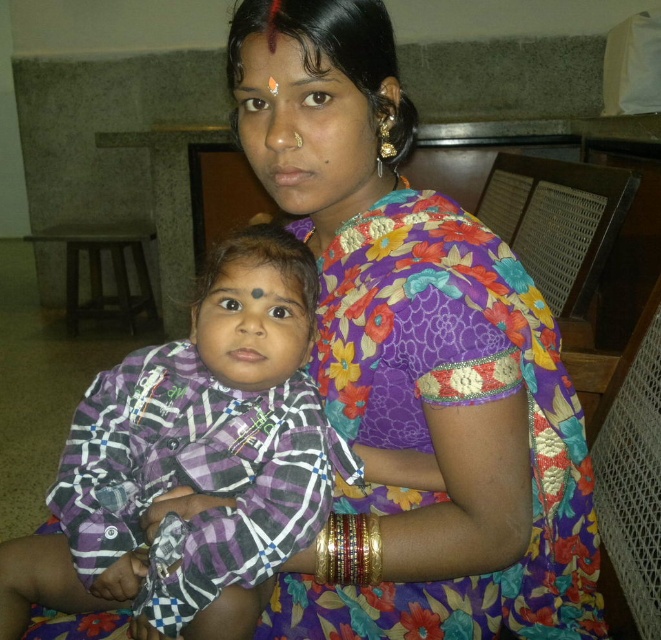
Question: Is floral silk saree at center behind matte black forehead at upper center?

Choices:
 (A) no
 (B) yes

Answer: (B)

Question: Does purple checkered shirt at center appear on the left side of matte black forehead at upper center?

Choices:
 (A) no
 (B) yes

Answer: (B)

Question: Which object is farther from the camera taking this photo?

Choices:
 (A) purple checkered shirt at center
 (B) matte black forehead at upper center

Answer: (A)

Question: Based on their relative distances, which object is nearer to the floral silk saree at center?

Choices:
 (A) matte black forehead at upper center
 (B) purple checkered shirt at center

Answer: (B)

Question: Which of these objects is positioned farthest from the floral silk saree at center?

Choices:
 (A) matte black forehead at upper center
 (B) purple checkered shirt at center

Answer: (A)

Question: Can you confirm if purple checkered shirt at center is wider than matte black forehead at upper center?

Choices:
 (A) yes
 (B) no

Answer: (A)